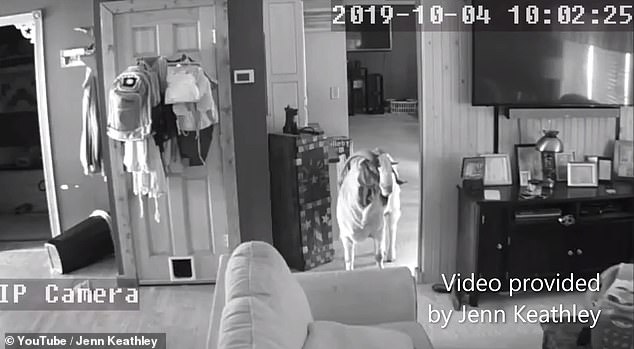
Where is `wall`? The height and width of the screenshot is (349, 634). wall is located at coordinates pyautogui.click(x=463, y=125), pyautogui.click(x=66, y=117).